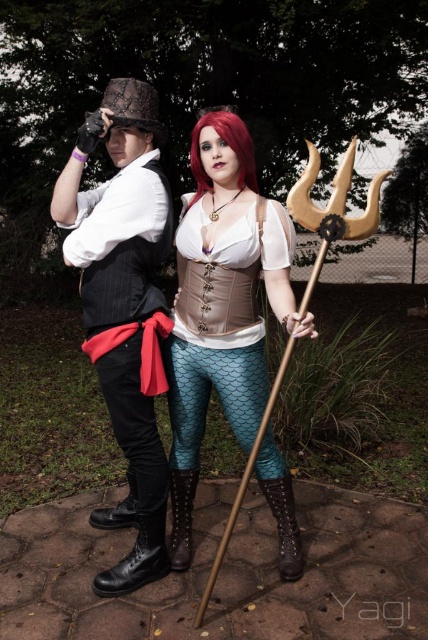
Question: Is teal fishscale leggings at center closer to the viewer compared to matte black vest at left?

Choices:
 (A) no
 (B) yes

Answer: (B)

Question: Estimate the real-world distances between objects in this image. Which object is closer to the leather lace-up boot at lower left?

Choices:
 (A) teal fishscale leggings at center
 (B) brown leather boot at lower center

Answer: (B)

Question: Is teal fishscale leggings at center positioned at the back of leather lace-up boot at lower left?

Choices:
 (A) yes
 (B) no

Answer: (B)

Question: Which point is farther from the camera taking this photo?

Choices:
 (A) (282, 577)
 (B) (71, 177)

Answer: (A)

Question: Can you confirm if teal fishscale leggings at center is bigger than brown leather boot at lower center?

Choices:
 (A) no
 (B) yes

Answer: (B)

Question: Which point is closer to the camera taking this photo?

Choices:
 (A) (190, 493)
 (B) (288, 474)

Answer: (B)